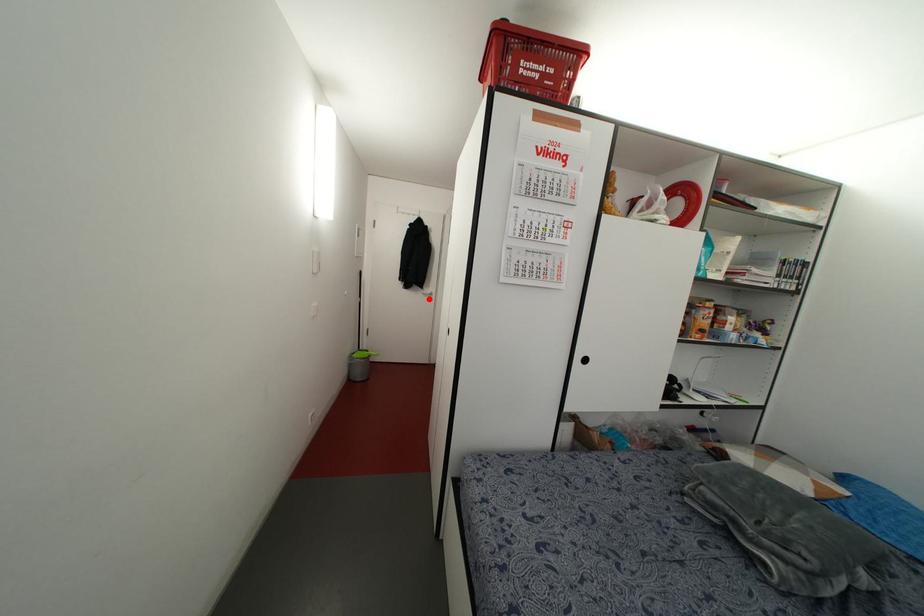
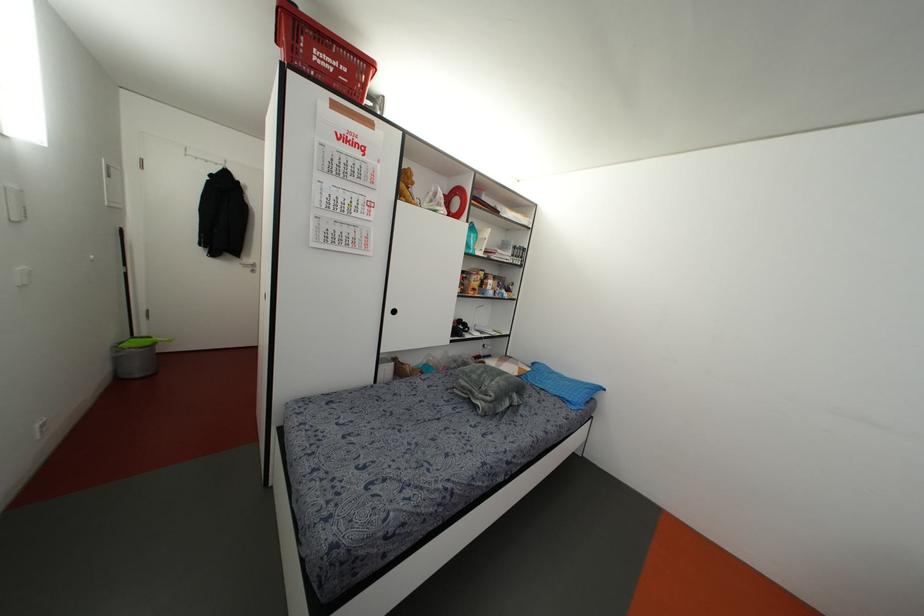
Find the pixel in the second image that matches the highlighted location in the first image.

(252, 270)